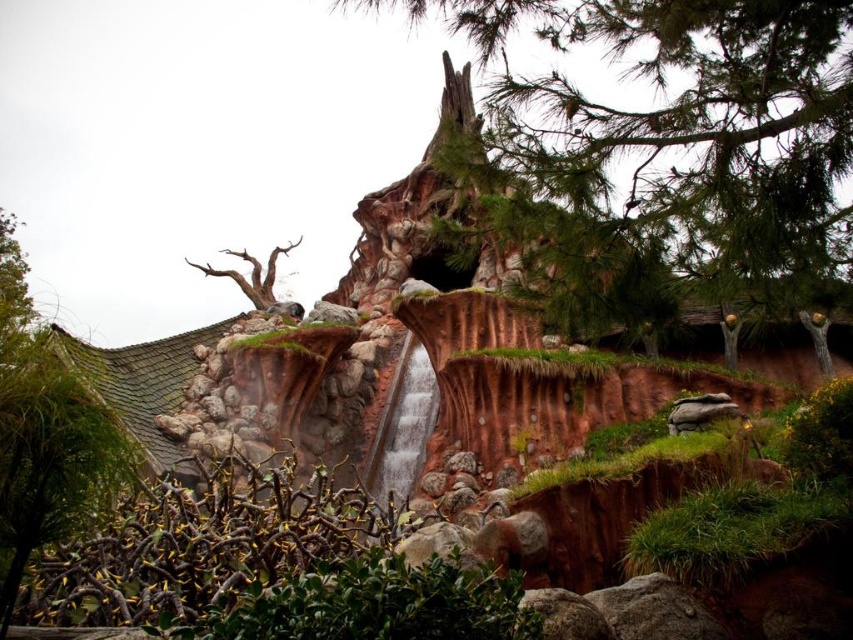
Question: Is rough bark tree at center further to the viewer compared to bare wood tree at upper left?

Choices:
 (A) yes
 (B) no

Answer: (B)

Question: Which object is the closest to the green mossy roof at left?

Choices:
 (A) bare wood tree at upper left
 (B) rough bark tree at center

Answer: (A)

Question: Considering the real-world distances, which object is closest to the bare wood tree at upper left?

Choices:
 (A) green mossy roof at left
 (B) rough bark tree at center

Answer: (A)

Question: Is green mossy roof at left to the right of bare wood tree at upper left from the viewer's perspective?

Choices:
 (A) no
 (B) yes

Answer: (A)

Question: Can you confirm if rough bark tree at center is positioned below green mossy roof at left?

Choices:
 (A) no
 (B) yes

Answer: (A)

Question: Which point appears farthest from the camera in this image?

Choices:
 (A) (569, 220)
 (B) (207, 269)
 (C) (1, 481)

Answer: (B)